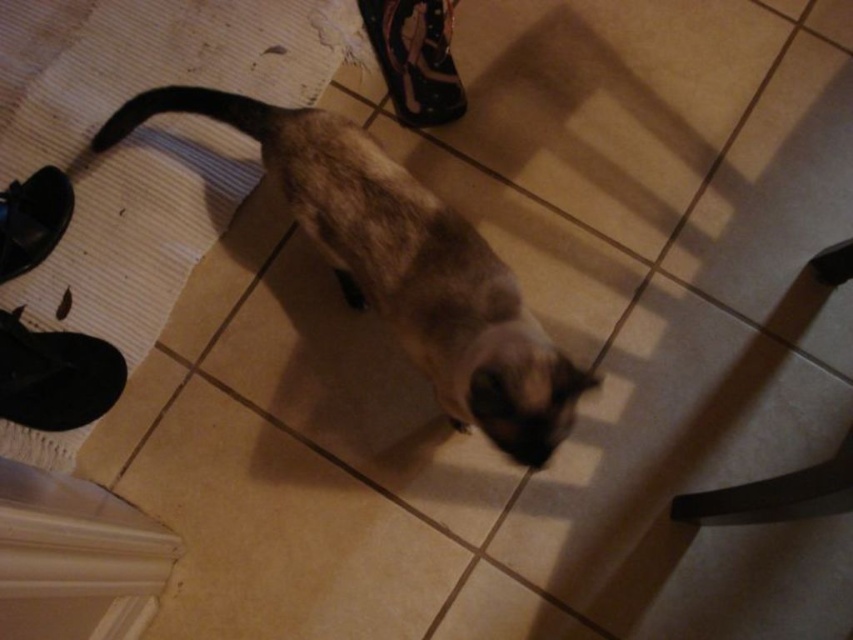
Which is more to the right, black suede sneaker at upper center or black rubber shoe at left?

black suede sneaker at upper center is more to the right.

Can you confirm if black suede sneaker at upper center is positioned below black rubber shoe at left?

Actually, black suede sneaker at upper center is above black rubber shoe at left.

Is point (421, 10) more distant than point (38, 216)?

Yes, point (421, 10) is farther from viewer.

Identify the location of black suede sneaker at upper center. (415, 58).

In the scene shown: Can you confirm if brown fur cat at center is thinner than black rubber shoe at left?

Incorrect, brown fur cat at center's width is not less than black rubber shoe at left's.

You are a GUI agent. You are given a task and a screenshot of the screen. Output one action in this format:
    pyautogui.click(x=<x>, y=<y>)
    Task: Click on the brown fur cat at center
    
    Given the screenshot: What is the action you would take?
    pyautogui.click(x=402, y=266)

Can you confirm if brown fur cat at center is positioned to the left of black suede sneaker at upper center?

Indeed, brown fur cat at center is positioned on the left side of black suede sneaker at upper center.

The height and width of the screenshot is (640, 853). Identify the location of brown fur cat at center. (402, 266).

This screenshot has height=640, width=853. Find the location of `brown fur cat at center`. brown fur cat at center is located at coordinates (402, 266).